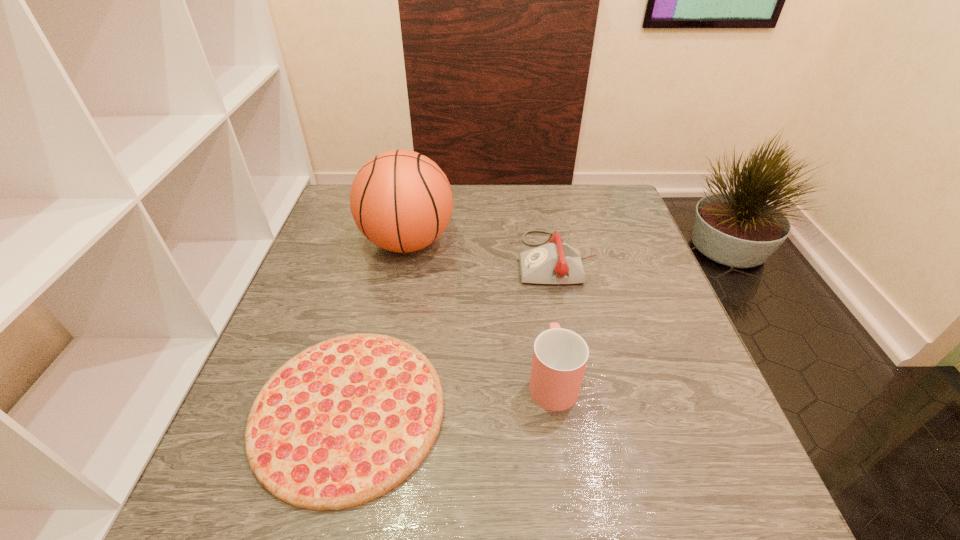
Locate an element on the screen. the tallest object is located at coordinates (401, 201).

I want to click on cup, so click(x=560, y=356).

This screenshot has width=960, height=540. In order to click on telephone in this screenshot , I will do `click(556, 263)`.

Identify the location of pizza. This screenshot has width=960, height=540. (345, 421).

Find the location of a particular element. Image resolution: width=960 pixels, height=540 pixels. free space located on the back of the tallest object is located at coordinates (416, 203).

Find the location of `vacant region located 0.360m on the side of the second tallest object with the handle`. vacant region located 0.360m on the side of the second tallest object with the handle is located at coordinates (533, 247).

At what (x,y) coordinates should I click in order to perform the action: click on blank area located 0.110m on the side of the second tallest object with the handle. Please return your answer as a coordinate pair (x, y). Image resolution: width=960 pixels, height=540 pixels. Looking at the image, I should click on (542, 314).

What are the coordinates of `vacant space situated on the side of the second tallest object with the handle` in the screenshot? It's located at (545, 334).

You are a GUI agent. You are given a task and a screenshot of the screen. Output one action in this format:
    pyautogui.click(x=<x>, y=<y>)
    Task: Click on the free space located on the dial of the third tallest object
    The width and height of the screenshot is (960, 540).
    Given the screenshot: What is the action you would take?
    pyautogui.click(x=417, y=259)

You are a GUI agent. You are given a task and a screenshot of the screen. Output one action in this format:
    pyautogui.click(x=<x>, y=<y>)
    Task: Click on the vacant region located on the dial of the third tallest object
    
    Given the screenshot: What is the action you would take?
    pyautogui.click(x=386, y=259)